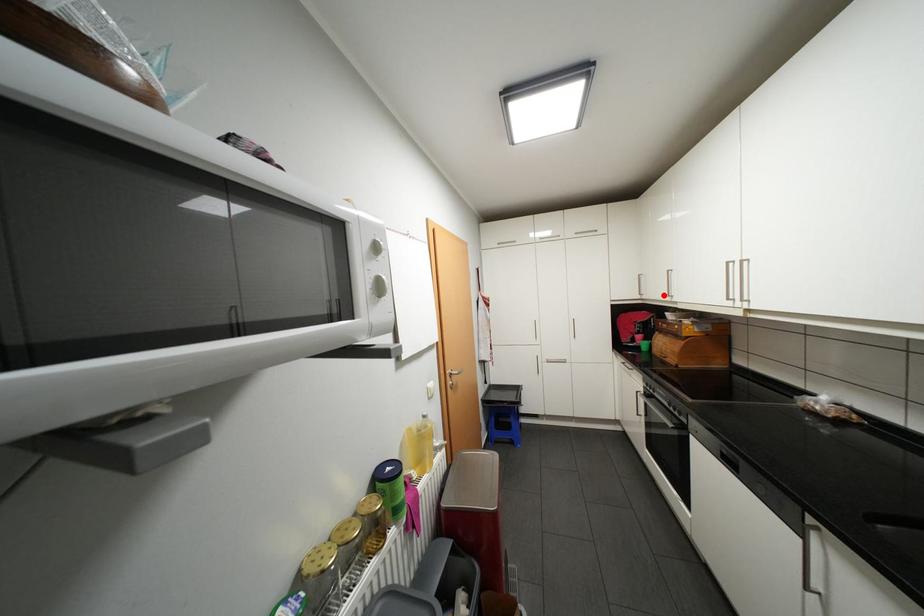
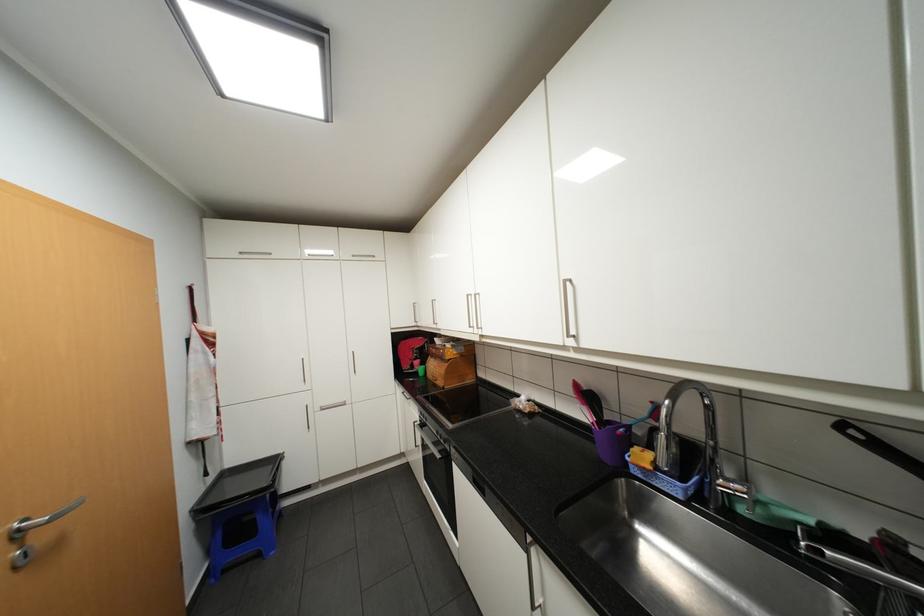
The point at the highlighted location is marked in the first image. Where is the corresponding point in the second image?

(434, 323)